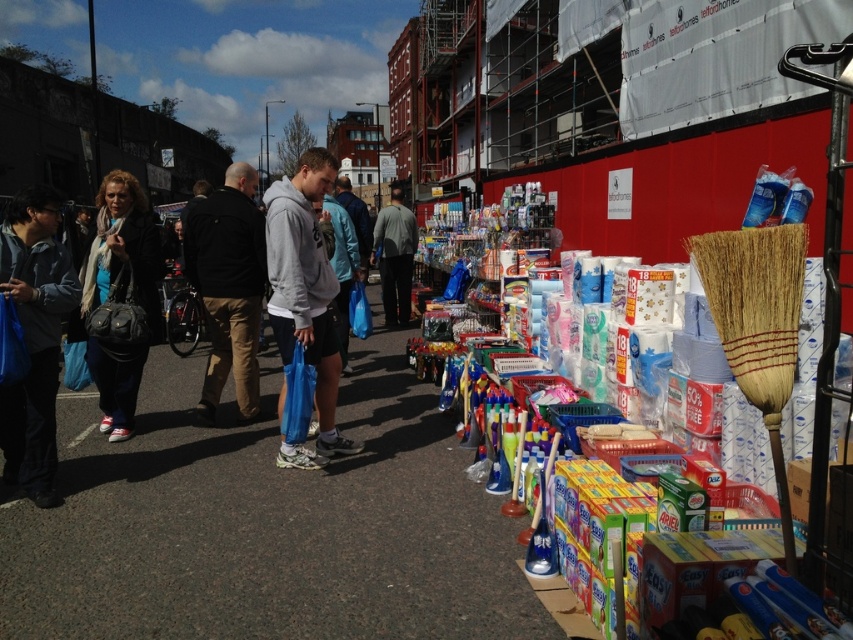
You are a customer looking to buy a hoodie and a handbag. You see the gray matte hoodie at center and the black leather handbag at left. Which item is thinner?

The gray matte hoodie at center is thinner than the black leather handbag at left.

You are a customer at the market and want to buy cleaning supplies. You have a blue fabric bag at left. Where is your bag positioned relative to the vendor stall?

The blue fabric bag at left is located at point [33,339], which places it to the left of the vendor stall.

You are standing at the camera position in the market scene. You see a blue fabric bag at left. Can you reach it without moving from your current position?

The blue fabric bag at left is 3.85 meters away from the camera position. Since this distance is greater than an average person can reach, you cannot reach it without moving.